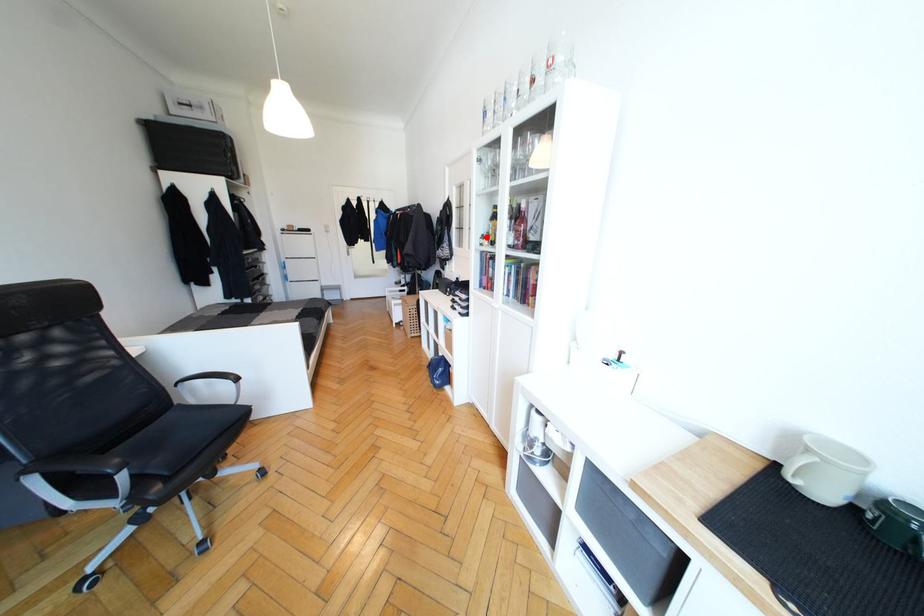
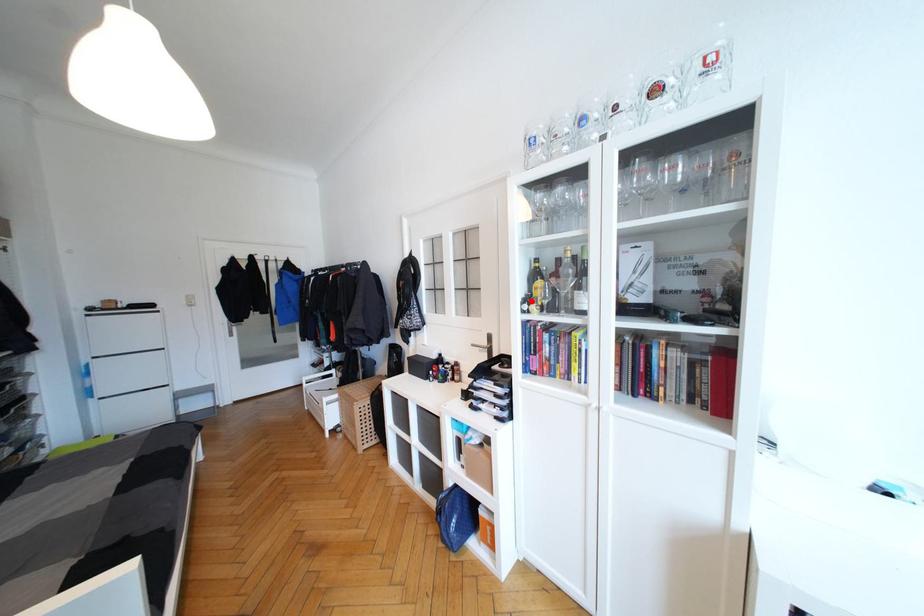
I am providing you with two images of the same scene from different viewpoints. A red point is marked on the first image and another point is marked on the second image. Is the marked point in image1 the same physical position as the marked point in image2?

Yes